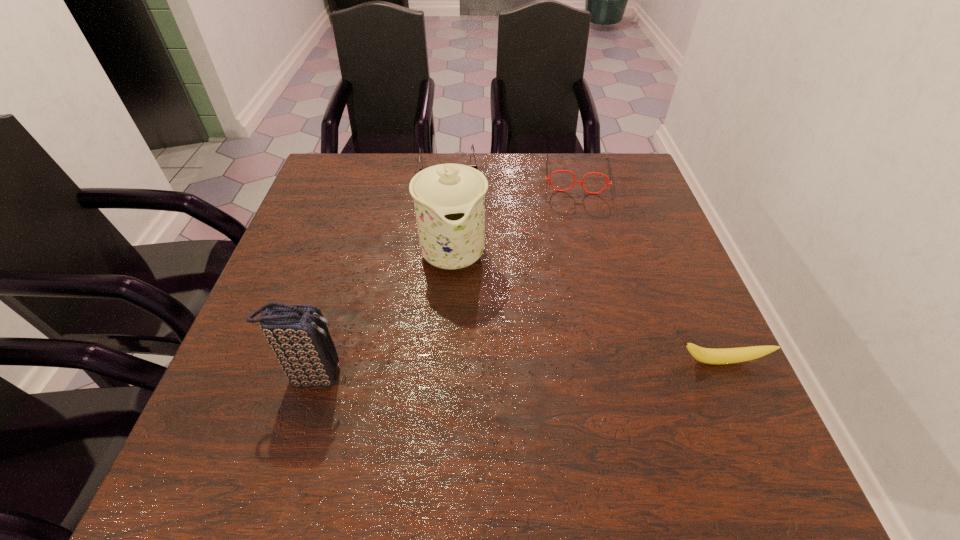
The height and width of the screenshot is (540, 960). What are the coordinates of `vacant space that's between the spectacles and the clutch bag` in the screenshot? It's located at (444, 275).

Find the location of a particular element. object that is the closest to the sunglasses is located at coordinates (449, 199).

Select which object is the closest to the spectacles. Please provide its 2D coordinates. Your answer should be formatted as a tuple, i.e. [(x, y)], where the tuple contains the x and y coordinates of a point satisfying the conditions above.

[(473, 166)]

Where is `vacant area in the image that satisfies the following two spatial constraints: 1. on the front side of the spectacles; 2. on the right side of the sunglasses`? The image size is (960, 540). vacant area in the image that satisfies the following two spatial constraints: 1. on the front side of the spectacles; 2. on the right side of the sunglasses is located at coordinates (447, 176).

Locate an element on the screen. The width and height of the screenshot is (960, 540). vacant area that satisfies the following two spatial constraints: 1. on the back side of the spectacles; 2. on the right side of the third farthest object is located at coordinates (458, 176).